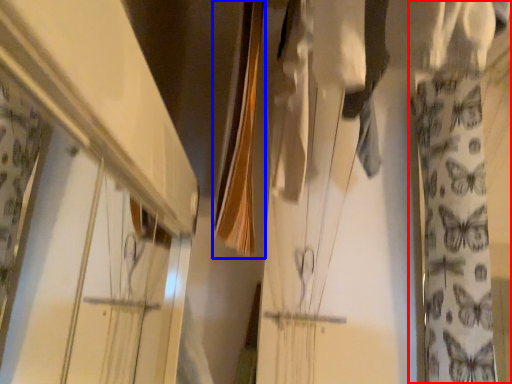
Question: Which object appears closest to the camera in this image, curtain (highlighted by a red box) or clothesline (highlighted by a blue box)?

Choices:
 (A) curtain
 (B) clothesline

Answer: (B)